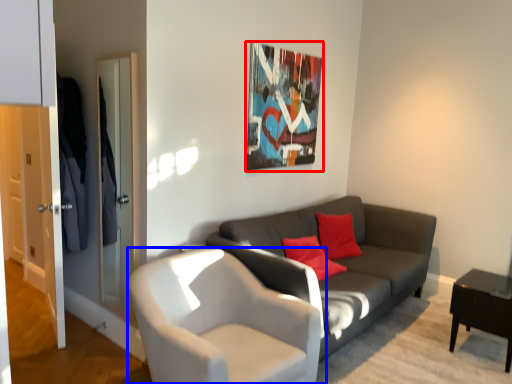
Question: Which object is closer to the camera taking this photo, picture frame (highlighted by a red box) or chair (highlighted by a blue box)?

Choices:
 (A) picture frame
 (B) chair

Answer: (B)